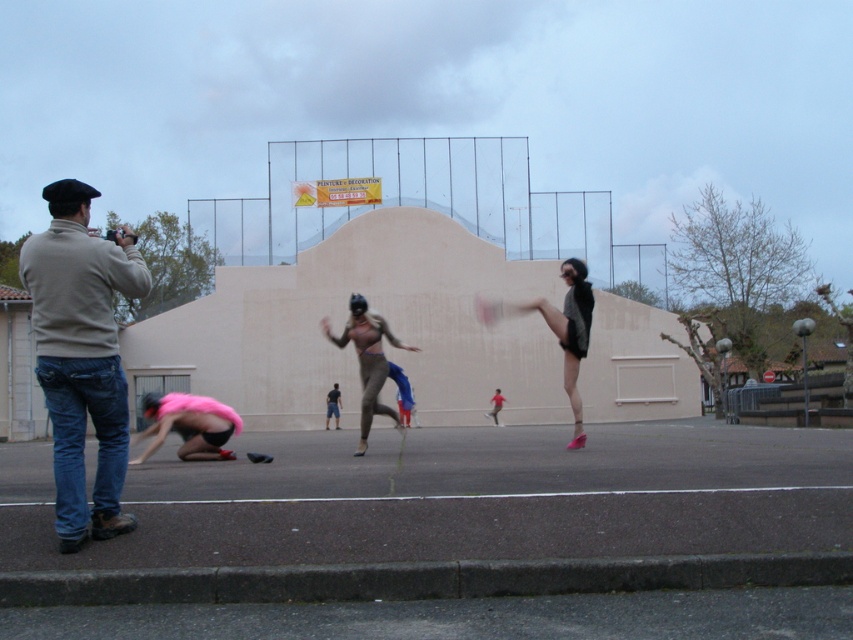
Between point (71, 308) and point (527, 310), which one is positioned in front?

Point (71, 308) is in front.

Who is taller, denim jeans at left or matte black shorts at center?

denim jeans at left is taller.

Who is more forward, (65, 211) or (561, 326)?

Point (65, 211) is more forward.

Where is `denim jeans at left`? The height and width of the screenshot is (640, 853). denim jeans at left is located at coordinates (80, 355).

Which of these two, denim jeans at left or pink fabric at lower left, stands shorter?

Standing shorter between the two is pink fabric at lower left.

Can you confirm if denim jeans at left is positioned above pink fabric at lower left?

Yes.

Does point (80, 278) lie in front of point (160, 403)?

That is True.

Locate an element on the screen. The height and width of the screenshot is (640, 853). denim jeans at left is located at coordinates (80, 355).

Is denim jeans at left further to the viewer compared to matte beige bodysuit at center?

No, it is not.

Which of these two, denim jeans at left or matte beige bodysuit at center, stands taller?

denim jeans at left is taller.

Does point (91, 413) come in front of point (355, 320)?

Yes.

Identify the location of denim jeans at left. The width and height of the screenshot is (853, 640). (80, 355).